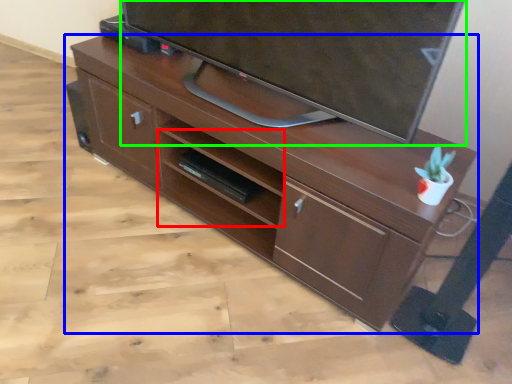
Question: Based on their relative distances, which object is nearer to shelf (highlighted by a red box)? Choose from desk (highlighted by a blue box) and television (highlighted by a green box).

Choices:
 (A) desk
 (B) television

Answer: (A)